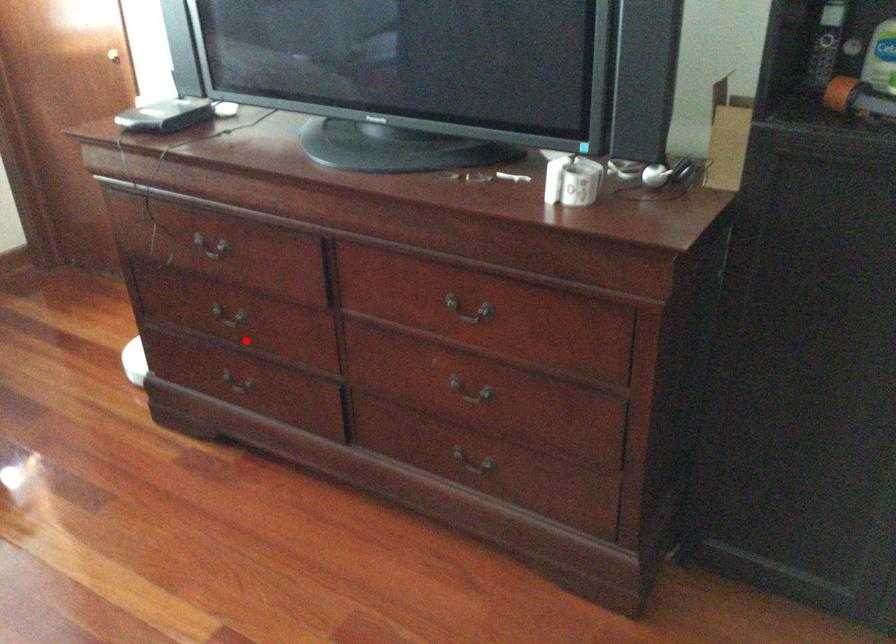
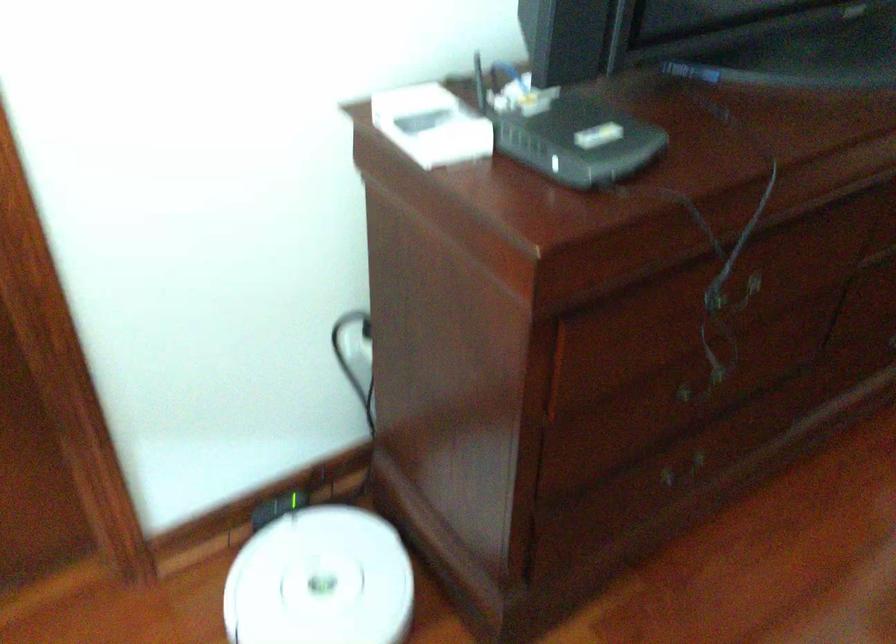
Question: I am providing you with two images of the same scene from different viewpoints. Given a red point in image1, look at the same physical point in image2. Is it:

Choices:
 (A) Closer to the viewpoint
 (B) Farther from the viewpoint

Answer: (A)